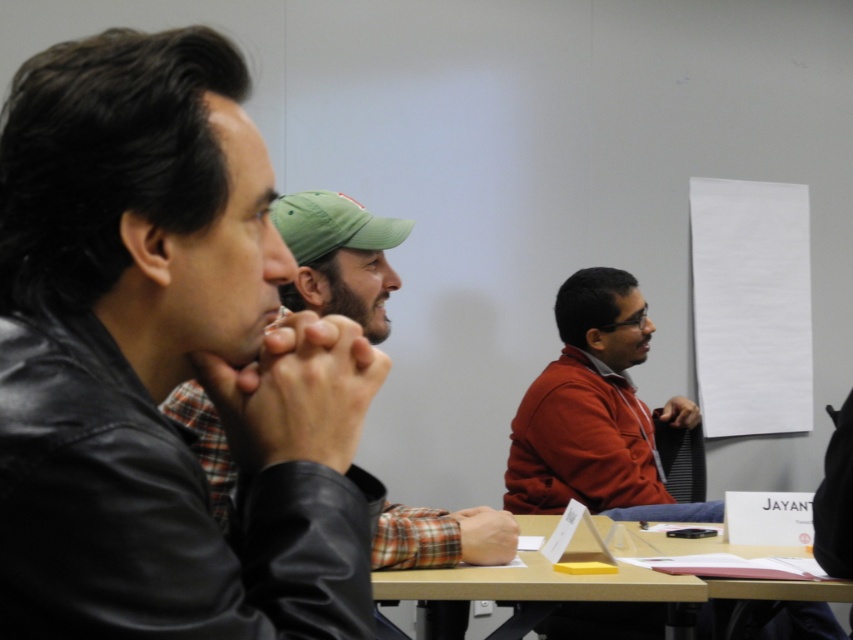
Does leather jacket at center have a lesser height compared to wooden table at center?

No.

Who is more forward, (198,392) or (529,593)?

Point (198,392) is in front.

Does point (318, 200) lie behind point (424, 600)?

Yes, it is behind point (424, 600).

In order to click on leather jacket at center in this screenshot , I will do [x=339, y=257].

Is point (630, 342) in front of point (527, 518)?

That is False.

At what (x,y) coordinates should I click in order to perform the action: click on matte red jacket at center. Please return your answer as a coordinate pair (x, y). Image resolution: width=853 pixels, height=640 pixels. Looking at the image, I should click on (590, 410).

Is point (354, 588) positioned behind point (583, 429)?

No, it is not.

The width and height of the screenshot is (853, 640). Identify the location of leather jacket at left. (164, 362).